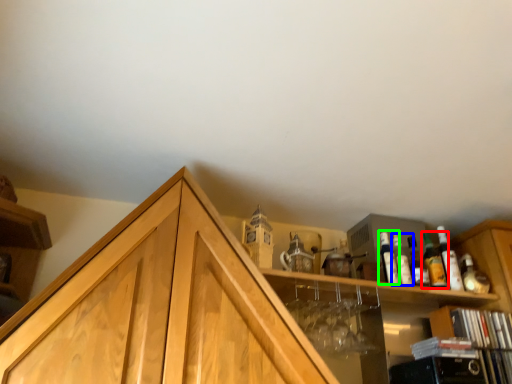
Question: Which object is the farthest from beer bottle (highlighted by a red box)? Choose among these: bottle (highlighted by a blue box) or bottle (highlighted by a green box).

Choices:
 (A) bottle
 (B) bottle

Answer: (B)